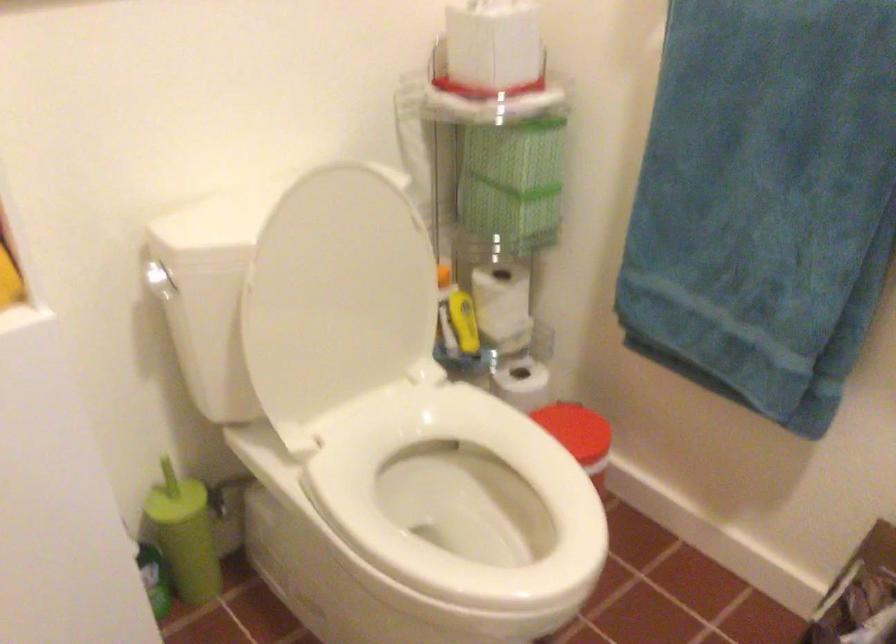
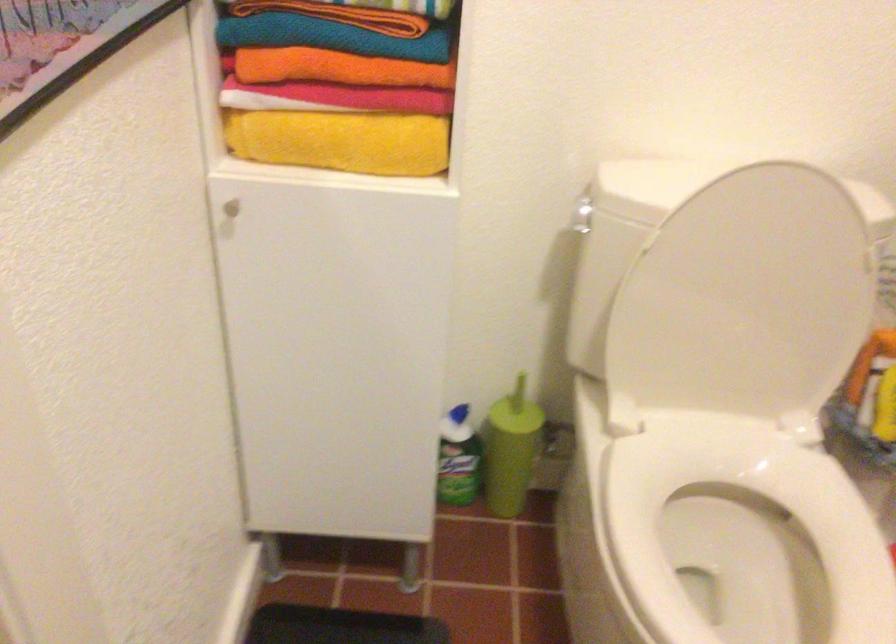
The point at (188, 534) is marked in the first image. Where is the corresponding point in the second image?

(511, 450)